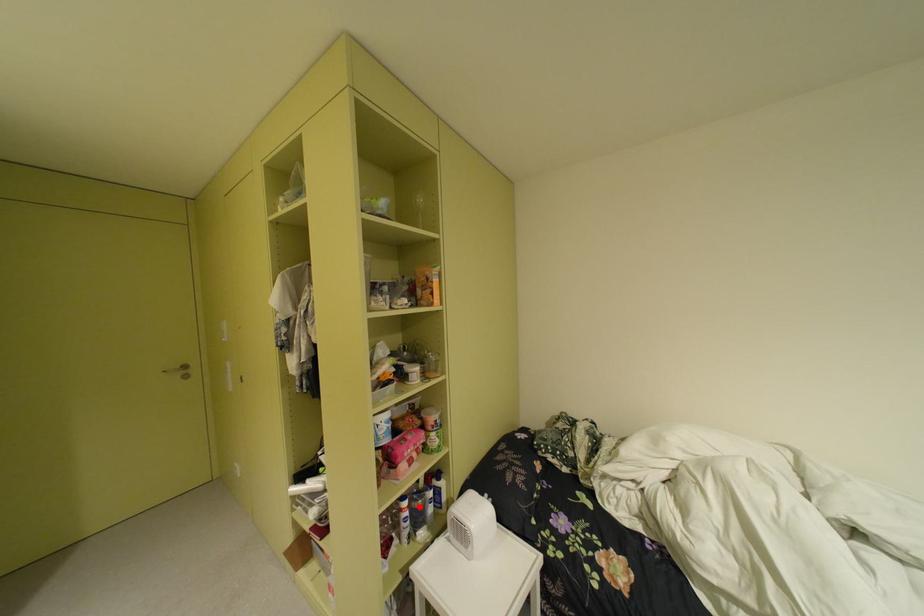
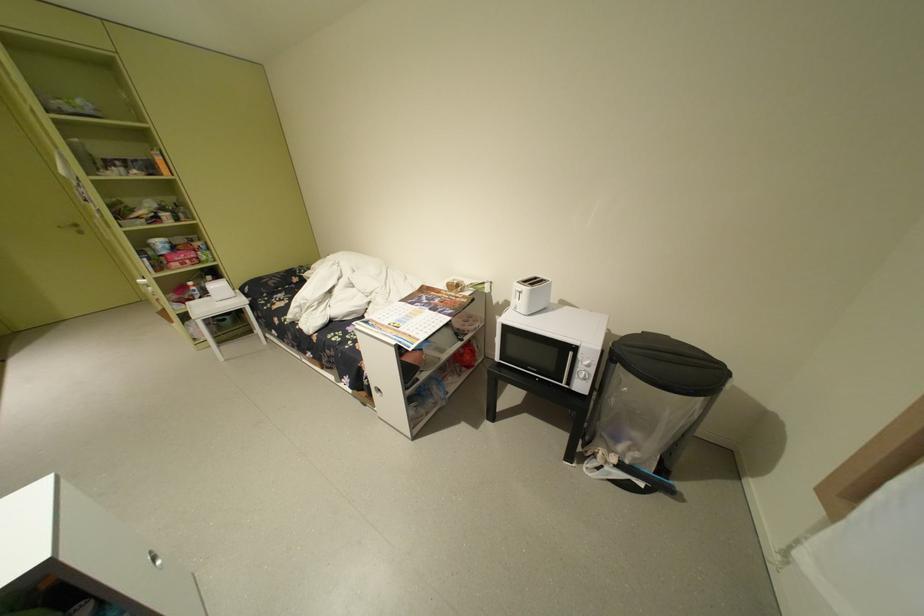
The point at the highlighted location is marked in the first image. Where is the corresponding point in the second image?

(204, 286)